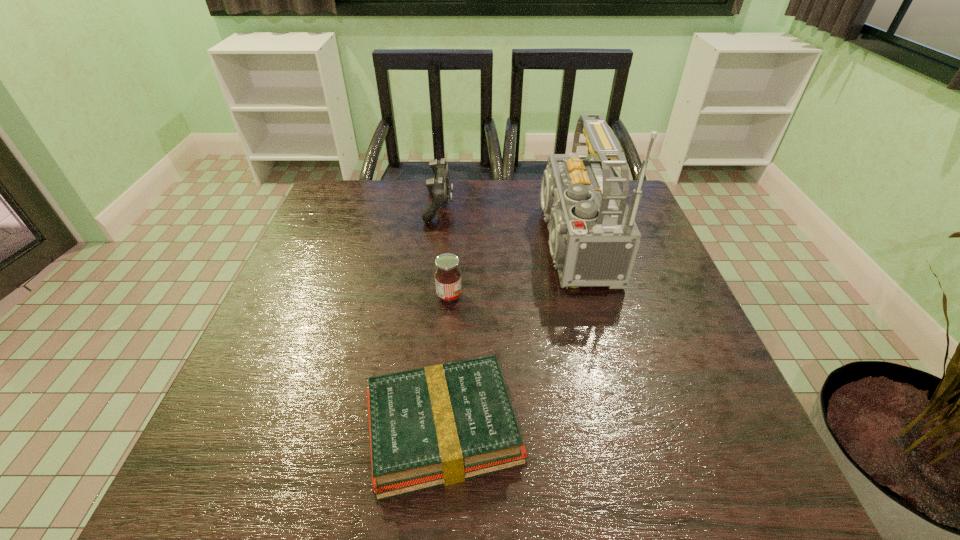
The width and height of the screenshot is (960, 540). What are the coordinates of `the tallest object` in the screenshot? It's located at (593, 237).

Locate an element on the screen. radio receiver is located at coordinates [x=593, y=237].

I want to click on control, so click(x=438, y=185).

You are a GUI agent. You are given a task and a screenshot of the screen. Output one action in this format:
    pyautogui.click(x=<x>, y=<y>)
    Task: Click on the second shortest object
    
    Given the screenshot: What is the action you would take?
    pyautogui.click(x=447, y=276)

Find the location of a particular element. Image resolution: width=960 pixels, height=540 pixels. the shortest object is located at coordinates (440, 425).

Locate an element on the screen. hardback book is located at coordinates (440, 425).

Identify the location of free space located 0.140m on the front-facing side of the radio receiver. Image resolution: width=960 pixels, height=540 pixels. (468, 243).

Locate an element on the screen. free spot located on the front-facing side of the radio receiver is located at coordinates (430, 243).

Find the location of a particular element. vacant region located 0.090m on the front-facing side of the radio receiver is located at coordinates (487, 243).

The image size is (960, 540). Identify the location of vacant region located on the surface of the control with buttons. (492, 206).